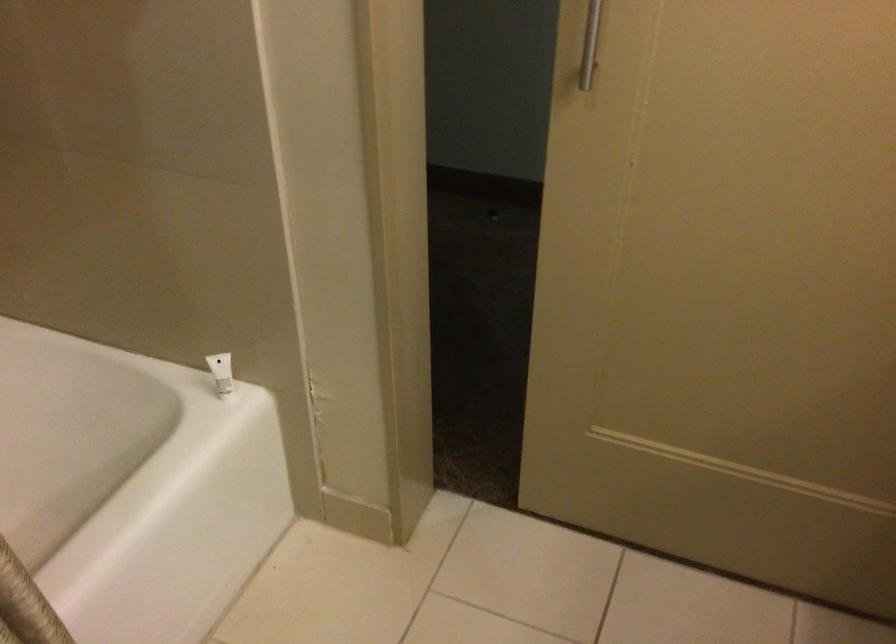
Which object does [220,372] point to?

This point indicates the small white tube.